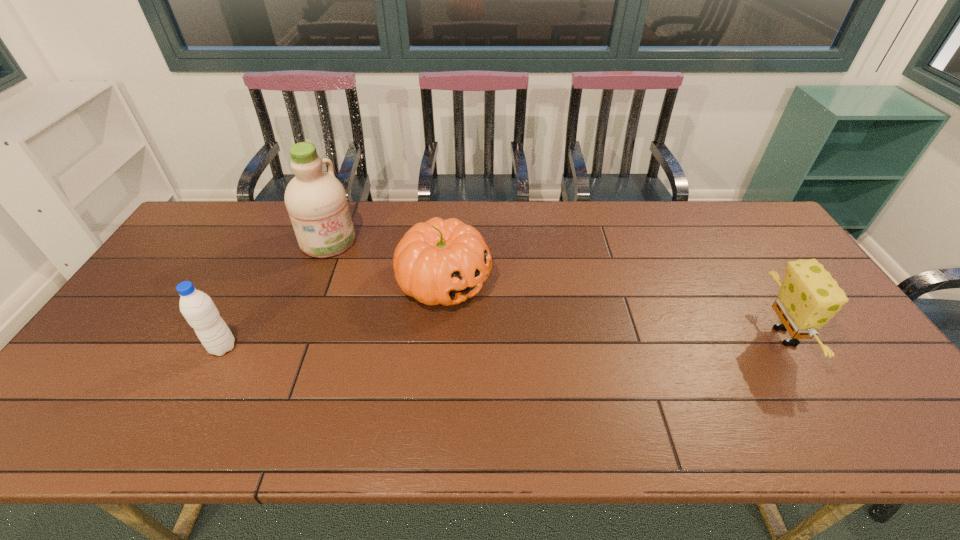
Locate an element on the screen. free space between the pumpkin and the leftmost object is located at coordinates (333, 314).

Select which object appears as the third closest to the water bottle. Please provide its 2D coordinates. Your answer should be formatted as a tuple, i.e. [(x, y)], where the tuple contains the x and y coordinates of a point satisfying the conditions above.

[(808, 297)]

At what (x,y) coordinates should I click in order to perform the action: click on object that is the closest to the water bottle. Please return your answer as a coordinate pair (x, y). Image resolution: width=960 pixels, height=540 pixels. Looking at the image, I should click on (316, 201).

Locate an element on the screen. The image size is (960, 540). free space that satisfies the following two spatial constraints: 1. on the front side of the sponge; 2. on the face of the pumpkin is located at coordinates pyautogui.click(x=440, y=336).

Identify the location of vacant area in the image that satisfies the following two spatial constraints: 1. on the front side of the third object from left to right; 2. on the face of the sponge. (440, 336).

Locate an element on the screen. The image size is (960, 540). free location that satisfies the following two spatial constraints: 1. on the back side of the leftmost object; 2. on the left side of the pumpkin is located at coordinates (257, 281).

Locate an element on the screen. free space that satisfies the following two spatial constraints: 1. on the front side of the pumpkin; 2. on the left side of the third object from right to left is located at coordinates (313, 281).

Locate an element on the screen. The image size is (960, 540). vacant region that satisfies the following two spatial constraints: 1. on the back side of the water bottle; 2. on the face of the rightmost object is located at coordinates (228, 336).

I want to click on vacant region that satisfies the following two spatial constraints: 1. on the front side of the tallest object; 2. on the face of the sponge, so click(292, 336).